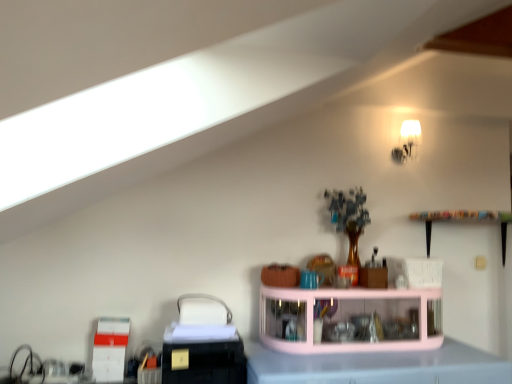
You are a GUI agent. You are given a task and a screenshot of the screen. Output one action in this format:
    pyautogui.click(x=<x>, y=<y>)
    Task: Click on the white frosted glass lampshade at upper right
    This screenshot has height=384, width=512.
    Given the screenshot: What is the action you would take?
    point(407,142)

What do you see at coordinates (350, 319) in the screenshot?
I see `pink glass shelf at center` at bounding box center [350, 319].

Find the location of a particular element. The image size is (512, 384). white frosted glass lampshade at upper right is located at coordinates (407, 142).

Which is behind, point (303, 341) or point (261, 365)?

The point (303, 341) is farther from the camera.

Is pink glass shelf at center aimed at pink glossy counter top at center?

No, pink glass shelf at center does not turn towards pink glossy counter top at center.

Locate an element on the screen. This screenshot has height=384, width=512. counter top that appears below the pink glass shelf at center (from a real-world perspective) is located at coordinates (378, 366).

Between pink glass shelf at center and pink glossy counter top at center, which one has larger size?

pink glossy counter top at center.

From a real-world perspective, is pink glossy counter top at center positioned above or below white frosted glass lampshade at upper right?

pink glossy counter top at center is situated lower than white frosted glass lampshade at upper right in the real world.

From the image's perspective, which is above, pink glossy counter top at center or white frosted glass lampshade at upper right?

white frosted glass lampshade at upper right appears higher in the image.

Would you say pink glossy counter top at center is outside white frosted glass lampshade at upper right?

Yes, pink glossy counter top at center is outside of white frosted glass lampshade at upper right.

Is white frosted glass lampshade at upper right oriented away from pink glossy counter top at center?

No, white frosted glass lampshade at upper right is not facing the opposite direction of pink glossy counter top at center.

Consider the image. Considering the relative sizes of white frosted glass lampshade at upper right and pink glossy counter top at center in the image provided, is white frosted glass lampshade at upper right bigger than pink glossy counter top at center?

No, white frosted glass lampshade at upper right is not bigger than pink glossy counter top at center.

Which is behind, point (412, 158) or point (377, 379)?

The point (412, 158) is farther from the camera.

At what (x,y) coordinates should I click in order to perform the action: click on light fixture behind the pink glossy counter top at center. Please return your answer as a coordinate pair (x, y). This screenshot has width=512, height=384. Looking at the image, I should click on (407, 142).

From a real-world perspective, which object stands above the other?

pink glass shelf at center.

Does pink glossy counter top at center have a greater height compared to pink glass shelf at center?

Correct, pink glossy counter top at center is much taller as pink glass shelf at center.

Where is `counter top in front of the pink glass shelf at center`? The width and height of the screenshot is (512, 384). counter top in front of the pink glass shelf at center is located at coordinates click(x=378, y=366).

From the image's perspective, which is above, pink glossy counter top at center or pink glass shelf at center?

pink glass shelf at center.

In the scene shown: Are pink glass shelf at center and white frosted glass lampshade at upper right located far from each other?

pink glass shelf at center is far away from white frosted glass lampshade at upper right.

Between pink glass shelf at center and white frosted glass lampshade at upper right, which one appears on the left side from the viewer's perspective?

From the viewer's perspective, pink glass shelf at center appears more on the left side.

How many degrees apart are the facing directions of pink glass shelf at center and white frosted glass lampshade at upper right?

The angular difference between pink glass shelf at center and white frosted glass lampshade at upper right is 3.36 degrees.

Where is `shelf that is on the left side of white frosted glass lampshade at upper right`? This screenshot has width=512, height=384. shelf that is on the left side of white frosted glass lampshade at upper right is located at coordinates (350, 319).

Is white frosted glass lampshade at upper right next to pink glass shelf at center and touching it?

white frosted glass lampshade at upper right is not next to pink glass shelf at center, and they're not touching.

Which is further, (406, 120) or (419, 348)?

The point (406, 120) is farther from the camera.

Is white frosted glass lampshade at upper right bigger or smaller than pink glass shelf at center?

white frosted glass lampshade at upper right is smaller than pink glass shelf at center.

In the image, there is a pink glass shelf at center. Where is `counter top below it (from the image's perspective)`? This screenshot has height=384, width=512. counter top below it (from the image's perspective) is located at coordinates (378, 366).

Find the location of a particular element. The height and width of the screenshot is (384, 512). counter top on the left of white frosted glass lampshade at upper right is located at coordinates (378, 366).

Looking at the image, which one is located closer to pink glass shelf at center, pink glossy counter top at center or white frosted glass lampshade at upper right?

Among the two, pink glossy counter top at center is located nearer to pink glass shelf at center.

Which object lies nearer to the anchor point pink glass shelf at center, white frosted glass lampshade at upper right or pink glossy counter top at center?

Among the two, pink glossy counter top at center is located nearer to pink glass shelf at center.

When comparing their distances from white frosted glass lampshade at upper right, does pink glass shelf at center or pink glossy counter top at center seem further?

Based on the image, pink glossy counter top at center appears to be further to white frosted glass lampshade at upper right.

Considering their positions, is pink glossy counter top at center positioned further to white frosted glass lampshade at upper right than pink glass shelf at center?

pink glossy counter top at center is positioned further to the anchor white frosted glass lampshade at upper right.

Consider the image. Which object lies nearer to the anchor point pink glossy counter top at center, pink glass shelf at center or white frosted glass lampshade at upper right?

Among the two, pink glass shelf at center is located nearer to pink glossy counter top at center.

Based on the photo, based on their spatial positions, is white frosted glass lampshade at upper right or pink glass shelf at center further from pink glossy counter top at center?

white frosted glass lampshade at upper right.

In order to click on shelf between white frosted glass lampshade at upper right and pink glossy counter top at center in the up-down direction in this screenshot , I will do `click(350, 319)`.